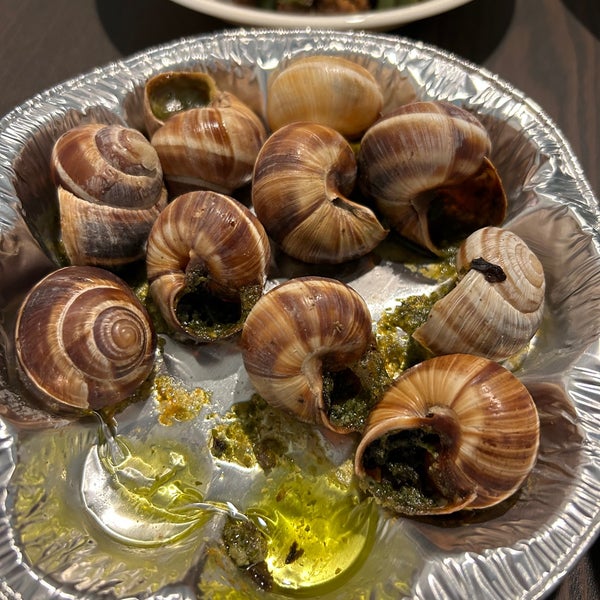
Identify the location of place to put utensil. (560, 66), (56, 41).